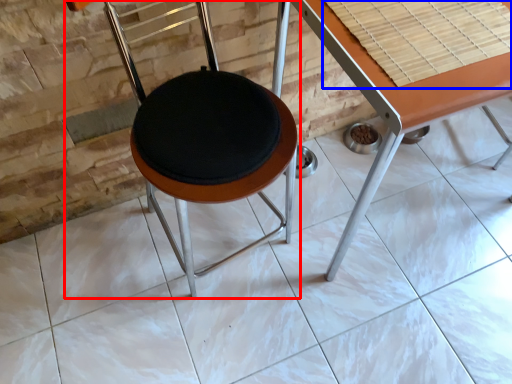
Question: Which object is closer to the camera taking this photo, chair (highlighted by a red box) or table top (highlighted by a blue box)?

Choices:
 (A) chair
 (B) table top

Answer: (A)